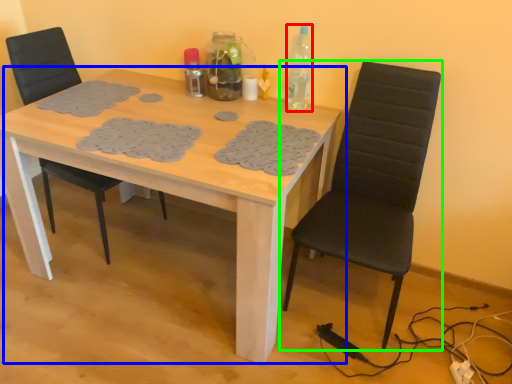
Question: Which object is positioned closest to bottle (highlighted by a red box)? Select from table (highlighted by a blue box) and chair (highlighted by a green box).

Choices:
 (A) table
 (B) chair

Answer: (B)